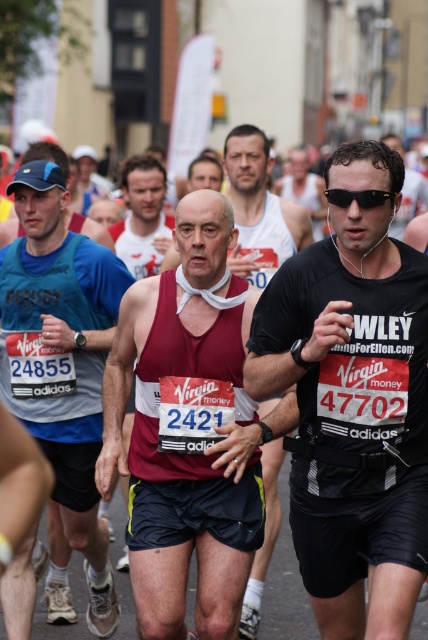
Question: Based on their relative distances, which object is farther from the blue fabric tank top at center?

Choices:
 (A) black matte t-shirt at center
 (B) matte white tank top at center
 (C) maroon fabric tank top at center
 (D) black plastic sunglasses at center

Answer: (B)

Question: Is maroon fabric tank top at center bigger than matte white tank top at center?

Choices:
 (A) no
 (B) yes

Answer: (A)

Question: Which of the following is the closest to the observer?

Choices:
 (A) black plastic sunglasses at center
 (B) black matte t-shirt at center

Answer: (B)

Question: Is maroon fabric tank top at center smaller than black plastic sunglasses at center?

Choices:
 (A) yes
 (B) no

Answer: (B)

Question: Estimate the real-world distances between objects in this image. Which object is farther from the matte white tank top at center?

Choices:
 (A) black matte t-shirt at center
 (B) maroon tank top at center

Answer: (A)

Question: Can you confirm if maroon fabric tank top at center is positioned to the left of maroon tank top at center?

Choices:
 (A) no
 (B) yes

Answer: (A)